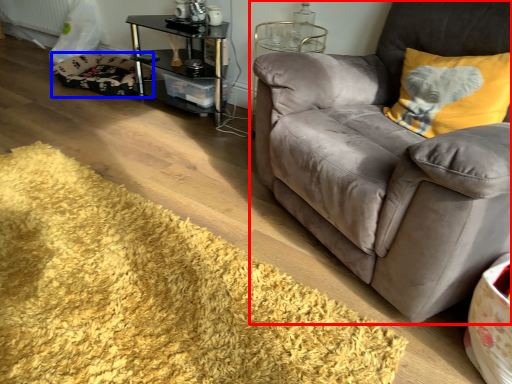
Question: Which object appears closest to the camera in this image, studio couch (highlighted by a red box) or dog bed (highlighted by a blue box)?

Choices:
 (A) studio couch
 (B) dog bed

Answer: (A)